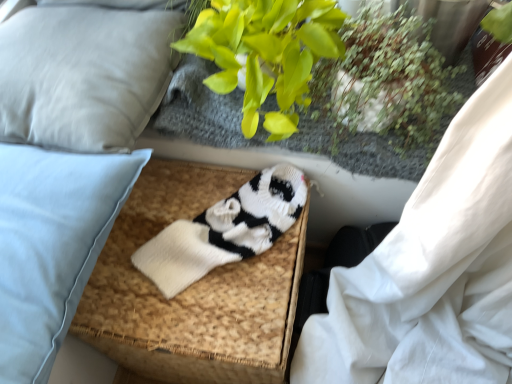
The height and width of the screenshot is (384, 512). Identify the location of free point above white knitted footrest at center (from a real-world perspective). (202, 254).